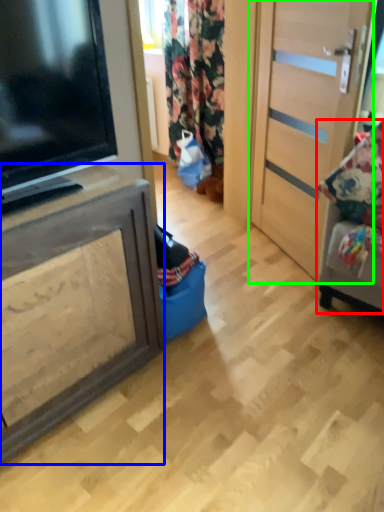
Question: Considering the real-world distances, which object is closest to furniture (highlighted by a red box)? cabinetry (highlighted by a blue box) or door (highlighted by a green box).

Choices:
 (A) cabinetry
 (B) door

Answer: (B)